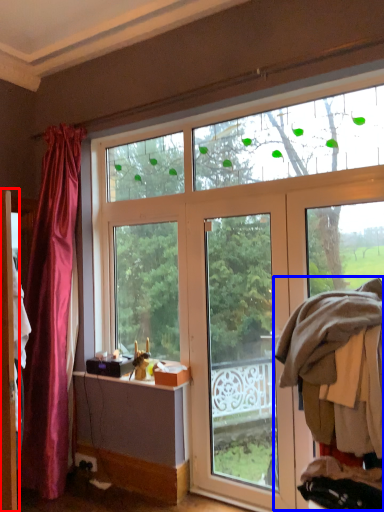
Question: Among these objects, which one is farthest to the camera, screen door (highlighted by a red box) or laundry (highlighted by a blue box)?

Choices:
 (A) screen door
 (B) laundry

Answer: (A)